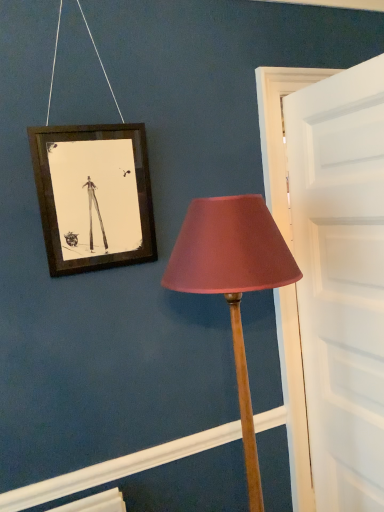
Where is `white matte door at right`? This screenshot has width=384, height=512. white matte door at right is located at coordinates (341, 279).

What do you see at coordinates (341, 279) in the screenshot? I see `white matte door at right` at bounding box center [341, 279].

Measure the distance between point [239,293] and camera.

Point [239,293] and camera are 3.55 feet apart.

Locate an element on the screen. Image resolution: width=384 pixels, height=512 pixels. matte pink fabric lampshade at center-right is located at coordinates (233, 282).

The width and height of the screenshot is (384, 512). Describe the element at coordinates (233, 282) in the screenshot. I see `matte pink fabric lampshade at center-right` at that location.

Locate an element on the screen. The height and width of the screenshot is (512, 384). white matte door at right is located at coordinates (341, 279).

Considering the relative positions of white matte door at right and matte pink fabric lampshade at center-right in the image provided, is white matte door at right to the left or to the right of matte pink fabric lampshade at center-right?

Clearly, white matte door at right is on the right of matte pink fabric lampshade at center-right in the image.

Which object is closer to the camera, white matte door at right or matte pink fabric lampshade at center-right?

matte pink fabric lampshade at center-right is in front.

From the picture: Which point is more forward, (345, 175) or (282, 239)?

The point (345, 175) is closer.

From the image's perspective, is white matte door at right on matte pink fabric lampshade at center-right?

Yes.

From a real-world perspective, between white matte door at right and matte pink fabric lampshade at center-right, who is vertically higher?

white matte door at right is physically above.

Which object is wider, white matte door at right or matte pink fabric lampshade at center-right?

Wider between the two is matte pink fabric lampshade at center-right.

Considering the relative sizes of white matte door at right and matte pink fabric lampshade at center-right in the image provided, is white matte door at right taller than matte pink fabric lampshade at center-right?

Yes, white matte door at right is taller than matte pink fabric lampshade at center-right.

Which of these two, white matte door at right or matte pink fabric lampshade at center-right, is bigger?

matte pink fabric lampshade at center-right is bigger.

Would you say white matte door at right is inside or outside matte pink fabric lampshade at center-right?

white matte door at right exists outside the volume of matte pink fabric lampshade at center-right.

Is white matte door at right directly adjacent to matte pink fabric lampshade at center-right?

No, white matte door at right is not making contact with matte pink fabric lampshade at center-right.

Is white matte door at right facing away from matte pink fabric lampshade at center-right?

Yes, white matte door at right is positioned with its back facing matte pink fabric lampshade at center-right.

The width and height of the screenshot is (384, 512). What are the coordinates of `door on the right of matte pink fabric lampshade at center-right` in the screenshot? It's located at (341, 279).

In the scene shown: Which is more to the right, matte pink fabric lampshade at center-right or white matte door at right?

white matte door at right is more to the right.

Which object is closer to the camera taking this photo, matte pink fabric lampshade at center-right or white matte door at right?

matte pink fabric lampshade at center-right.

Does point (195, 220) come farther from viewer compared to point (348, 275)?

No, (195, 220) is in front of (348, 275).

From the image's perspective, which is above, matte pink fabric lampshade at center-right or white matte door at right?

white matte door at right is shown above in the image.

From a real-world perspective, relative to white matte door at right, is matte pink fabric lampshade at center-right vertically above or below?

Clearly, from a real-world perspective, matte pink fabric lampshade at center-right is below white matte door at right.

Is matte pink fabric lampshade at center-right thinner than white matte door at right?

No, matte pink fabric lampshade at center-right is not thinner than white matte door at right.

Considering the sizes of objects matte pink fabric lampshade at center-right and white matte door at right in the image provided, who is taller, matte pink fabric lampshade at center-right or white matte door at right?

With more height is white matte door at right.

Does matte pink fabric lampshade at center-right have a larger size compared to white matte door at right?

Correct, matte pink fabric lampshade at center-right is larger in size than white matte door at right.

Do you think matte pink fabric lampshade at center-right is within white matte door at right, or outside of it?

matte pink fabric lampshade at center-right cannot be found inside white matte door at right.

Is matte pink fabric lampshade at center-right not close to white matte door at right?

No, matte pink fabric lampshade at center-right is in close proximity to white matte door at right.

Is white matte door at right at the back of matte pink fabric lampshade at center-right?

No, matte pink fabric lampshade at center-right is not facing away from white matte door at right.

Can you tell me how much matte pink fabric lampshade at center-right and white matte door at right differ in facing direction?

The angle between the facing direction of matte pink fabric lampshade at center-right and the facing direction of white matte door at right is 85.4 degrees.

Identify the location of door located on the right of matte pink fabric lampshade at center-right. The height and width of the screenshot is (512, 384). (341, 279).

The image size is (384, 512). Identify the location of door behind the matte pink fabric lampshade at center-right. (341, 279).

The width and height of the screenshot is (384, 512). Identify the location of lamp that is under the white matte door at right (from a real-world perspective). (233, 282).